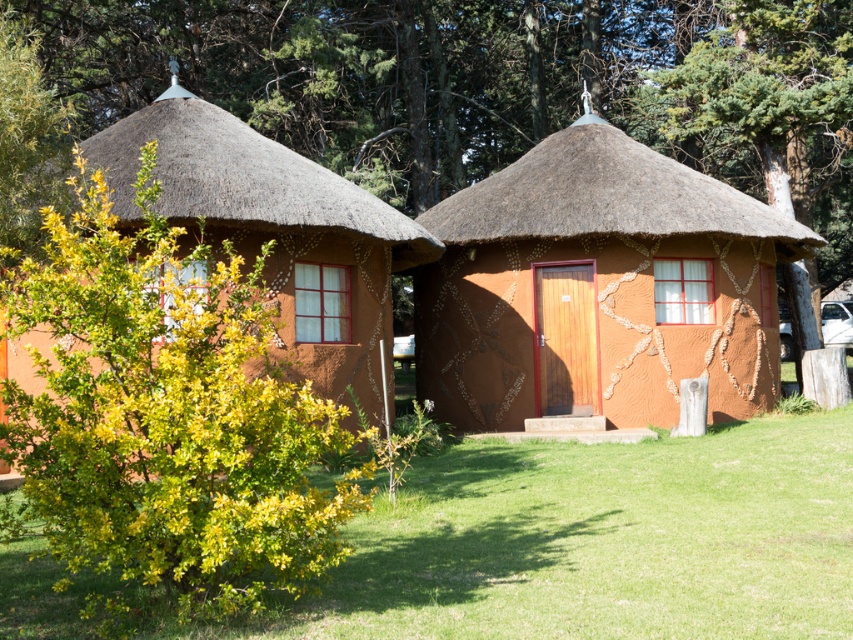
Does green leafy bush at center have a smaller size compared to green grass at lower center?

Incorrect, green leafy bush at center is not smaller in size than green grass at lower center.

Does green leafy bush at center appear over green grass at lower center?

Yes.

Does point (614, 152) lie in front of point (735, 451)?

No, it is not.

Where is `green leafy bush at center`? green leafy bush at center is located at coordinates (498, 99).

Does point (846, 426) come in front of point (792, 4)?

Yes, point (846, 426) is in front of point (792, 4).

Between point (529, 476) and point (750, 68), which one is positioned behind?

The point (750, 68) is behind.

I want to click on green grass at lower center, so click(x=598, y=541).

Is green leafy bush at center to the left of thatched straw roof at upper left from the viewer's perspective?

In fact, green leafy bush at center is to the right of thatched straw roof at upper left.

Is point (482, 164) farther from camera compared to point (271, 221)?

Yes, it is behind point (271, 221).

Where is `green leafy bush at center`? green leafy bush at center is located at coordinates (498, 99).